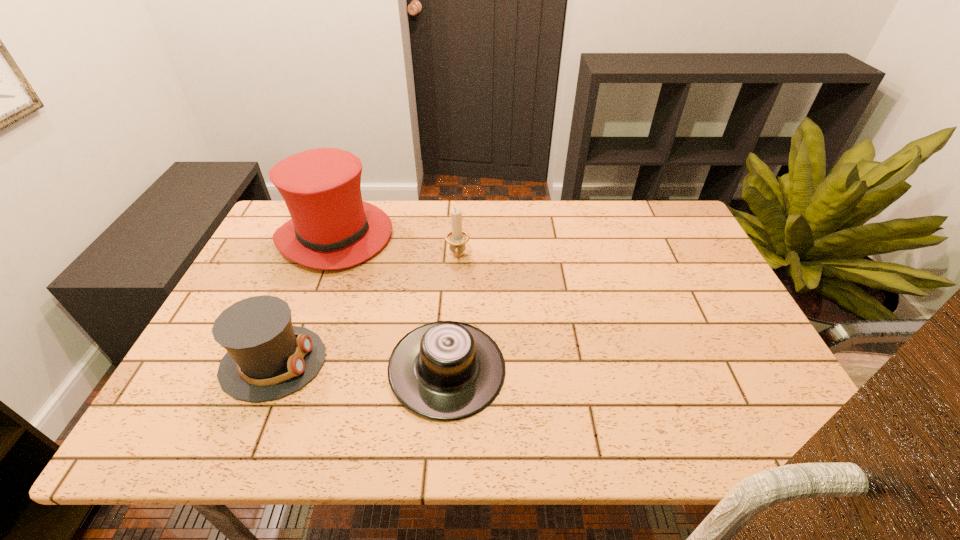
At what (x,y) coordinates should I click in order to perform the action: click on vacant region between the candle_holder and the shortest object. Please return your answer as a coordinate pair (x, y). The image size is (960, 540). Looking at the image, I should click on (452, 313).

Find the location of a particular element. free space between the candle_holder and the shortest object is located at coordinates (452, 313).

You are a GUI agent. You are given a task and a screenshot of the screen. Output one action in this format:
    pyautogui.click(x=<x>, y=<y>)
    Task: Click on the free space that is in between the second shortest dress hat and the farthest dress hat
    
    Given the screenshot: What is the action you would take?
    pyautogui.click(x=304, y=299)

The height and width of the screenshot is (540, 960). In order to click on vacant area between the tallest dress hat and the second shortest dress hat in this screenshot , I will do `click(304, 299)`.

I want to click on free space between the shortest dress hat and the candle_holder, so click(452, 313).

This screenshot has height=540, width=960. Identify the location of free space between the candle_holder and the tallest object. (396, 247).

The width and height of the screenshot is (960, 540). What are the coordinates of `vacant space that's between the shortest object and the second shortest dress hat` in the screenshot? It's located at (360, 366).

Find the location of a particular element. The width and height of the screenshot is (960, 540). vacant space that is in between the candle_holder and the farthest dress hat is located at coordinates (396, 247).

What are the coordinates of `free spot between the candle_holder and the tallest dress hat` in the screenshot? It's located at (396, 247).

Locate an element on the screen. This screenshot has height=540, width=960. the third closest object to the rightmost dress hat is located at coordinates (457, 238).